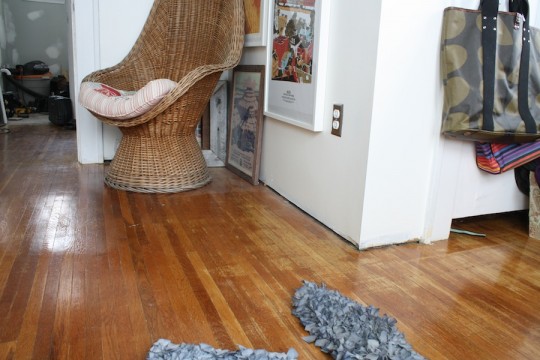
Locate an element on the screen. This screenshot has width=540, height=360. closed door is located at coordinates (485, 198).